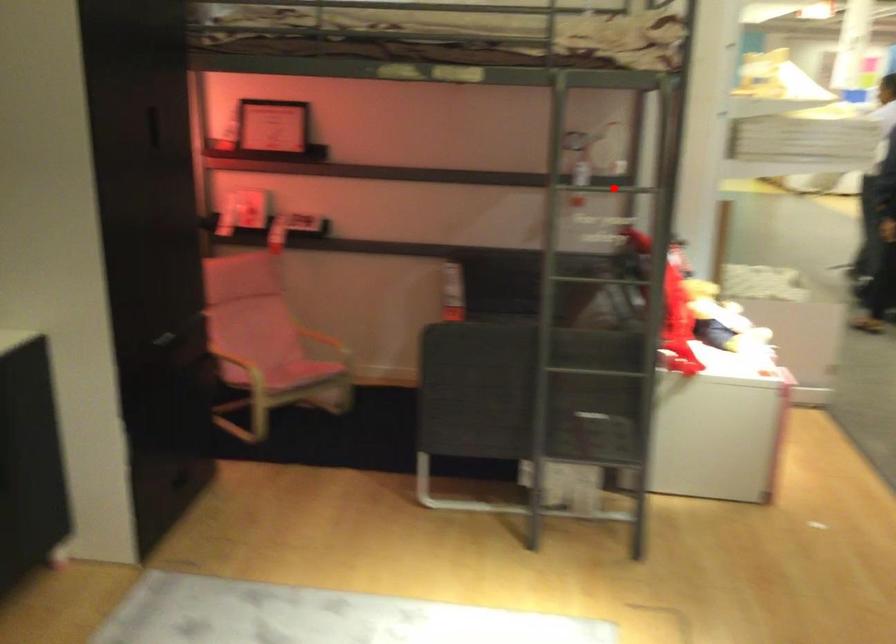
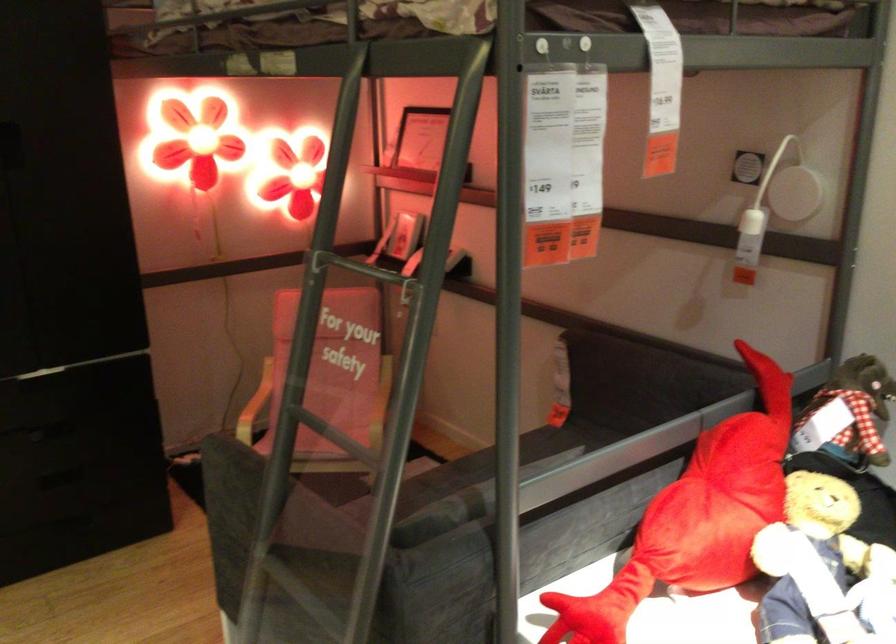
Question: I am providing you with two images of the same scene from different viewpoints. In image1, a red point is highlighted. Considering the same 3D point in image2, which of the following is correct?

Choices:
 (A) It is closer
 (B) It is farther

Answer: (A)